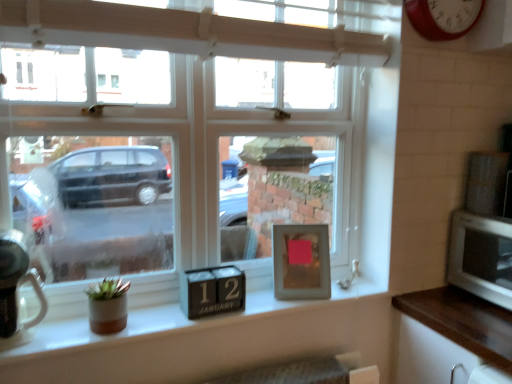
The width and height of the screenshot is (512, 384). In order to click on blank space to the left of silver metallic microwave at right in this screenshot , I will do `click(445, 311)`.